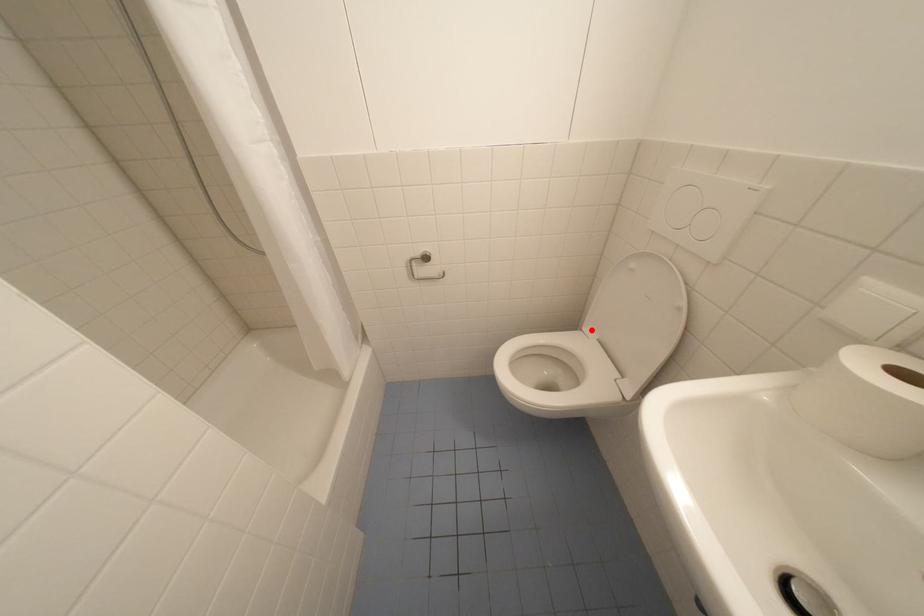
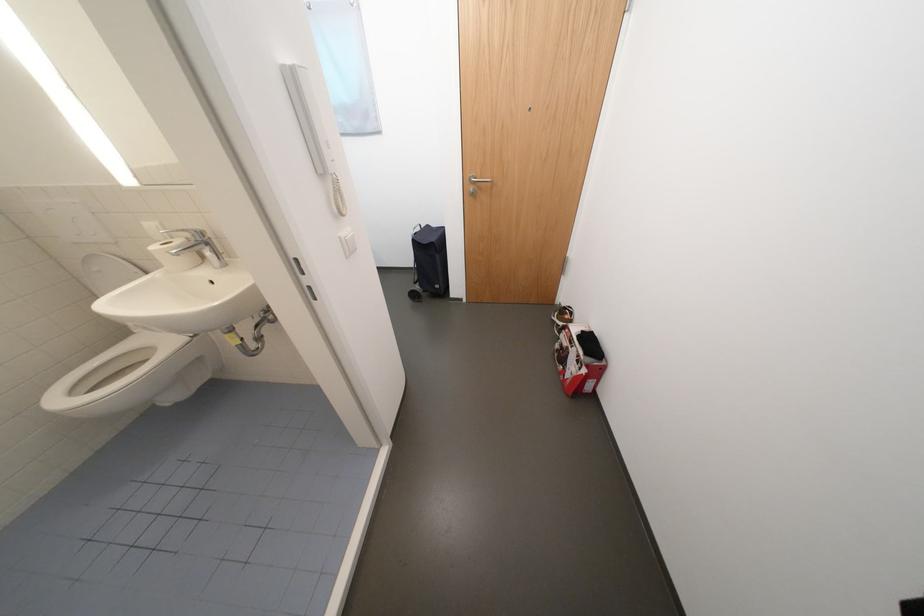
Question: I am providing you with two images of the same scene from different viewpoints. Given a red point in image1, look at the same physical point in image2. Is it:

Choices:
 (A) Closer to the viewpoint
 (B) Farther from the viewpoint

Answer: (B)